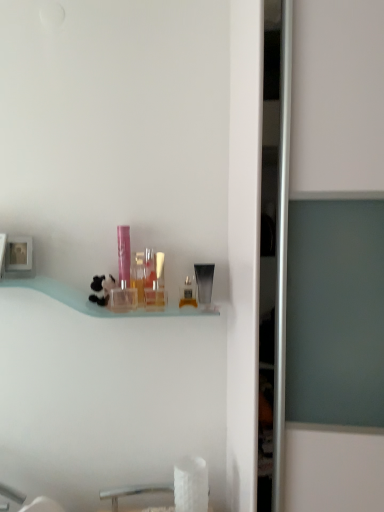
Question: Can you confirm if translucent plastic perfume bottle at center, positioned as the third toiletry in right-to-left order, is wider than pink glossy tube at center, the first toiletry from the left?

Choices:
 (A) yes
 (B) no

Answer: (A)

Question: Considering the relative sizes of translucent plastic perfume bottle at center, positioned as the third toiletry in right-to-left order, and pink glossy tube at center, the first toiletry from the left, in the image provided, is translucent plastic perfume bottle at center, positioned as the third toiletry in right-to-left order, smaller than pink glossy tube at center, the first toiletry from the left,?

Choices:
 (A) yes
 (B) no

Answer: (A)

Question: Does translucent plastic perfume bottle at center, positioned as the third toiletry in right-to-left order, have a greater height compared to pink glossy tube at center, placed as the sixth toiletry when sorted from right to left?

Choices:
 (A) yes
 (B) no

Answer: (B)

Question: Is translucent plastic perfume bottle at center, the 4th toiletry when ordered from left to right, oriented towards pink glossy tube at center, placed as the sixth toiletry when sorted from right to left?

Choices:
 (A) yes
 (B) no

Answer: (B)

Question: Is translucent plastic perfume bottle at center, the 4th toiletry when ordered from left to right, positioned with its back to pink glossy tube at center, the first toiletry from the left?

Choices:
 (A) yes
 (B) no

Answer: (B)

Question: Considering their positions, is translucent plastic perfume bottle at center, the 4th toiletry when ordered from left to right, located in front of or behind white ceramic sink at lower center?

Choices:
 (A) behind
 (B) front

Answer: (B)

Question: From a real-world perspective, is translucent plastic perfume bottle at center, positioned as the third toiletry in right-to-left order, above or below white ceramic sink at lower center?

Choices:
 (A) below
 (B) above

Answer: (B)

Question: From their relative heights in the image, would you say translucent plastic perfume bottle at center, positioned as the third toiletry in right-to-left order, is taller or shorter than white ceramic sink at lower center?

Choices:
 (A) tall
 (B) short

Answer: (A)

Question: Would you say translucent plastic perfume bottle at center, the 4th toiletry when ordered from left to right, is to the left or to the right of white ceramic sink at lower center in the picture?

Choices:
 (A) left
 (B) right

Answer: (B)

Question: From a real-world perspective, is translucent plastic container at center, the fifth toiletry in the right-to-left sequence, positioned above or below pink glossy tube at center, the first toiletry from the left?

Choices:
 (A) below
 (B) above

Answer: (A)

Question: Considering the positions of translucent plastic container at center, the fifth toiletry in the right-to-left sequence, and pink glossy tube at center, placed as the sixth toiletry when sorted from right to left, in the image, is translucent plastic container at center, the fifth toiletry in the right-to-left sequence, wider or thinner than pink glossy tube at center, placed as the sixth toiletry when sorted from right to left,?

Choices:
 (A) thin
 (B) wide

Answer: (B)

Question: Choose the correct answer: Is translucent plastic container at center, the 2th toiletry viewed from the left, inside pink glossy tube at center, the first toiletry from the left, or outside it?

Choices:
 (A) outside
 (B) inside

Answer: (A)

Question: In terms of height, does translucent plastic container at center, the 2th toiletry viewed from the left, look taller or shorter compared to pink glossy tube at center, placed as the sixth toiletry when sorted from right to left?

Choices:
 (A) short
 (B) tall

Answer: (A)

Question: From a real-world perspective, relative to clear plastic bottle at center, the 5th toiletry in the left-to-right sequence, is translucent plastic container at center, the fifth toiletry in the right-to-left sequence, vertically above or below?

Choices:
 (A) above
 (B) below

Answer: (A)

Question: Considering the relative positions of translucent plastic container at center, the 2th toiletry viewed from the left, and clear plastic bottle at center, the 5th toiletry in the left-to-right sequence, in the image provided, is translucent plastic container at center, the 2th toiletry viewed from the left, to the left or to the right of clear plastic bottle at center, the 5th toiletry in the left-to-right sequence,?

Choices:
 (A) right
 (B) left

Answer: (B)